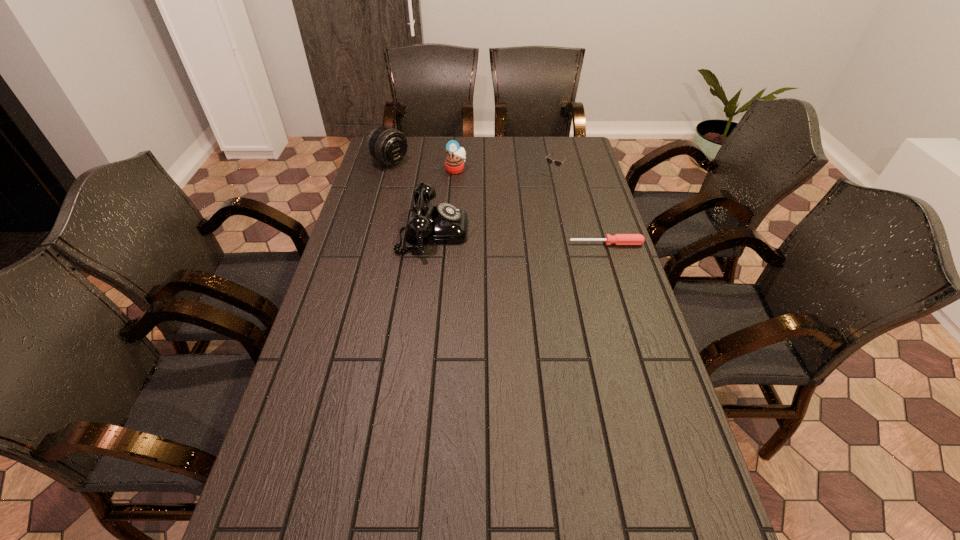
Locate an element on the screen. vacant area situated in front of the lenses of the fourth tallest object is located at coordinates (507, 219).

Identify the location of vacant area located 0.300m in front of the lenses of the fourth tallest object. This screenshot has width=960, height=540. (506, 220).

Where is `vacant space located in front of the lenses of the fourth tallest object`? Image resolution: width=960 pixels, height=540 pixels. vacant space located in front of the lenses of the fourth tallest object is located at coordinates (516, 208).

Where is `vacant area situated 0.090m on the front-facing side of the telephoto lens`? Image resolution: width=960 pixels, height=540 pixels. vacant area situated 0.090m on the front-facing side of the telephoto lens is located at coordinates (418, 177).

This screenshot has height=540, width=960. Find the location of `vacant position located 0.240m on the front-facing side of the telephoto lens`. vacant position located 0.240m on the front-facing side of the telephoto lens is located at coordinates (444, 192).

Locate an element on the screen. The height and width of the screenshot is (540, 960). vacant area situated 0.080m on the front-facing side of the telephoto lens is located at coordinates (416, 176).

Locate an element on the screen. The width and height of the screenshot is (960, 540). muffin that is at the far edge is located at coordinates (454, 162).

Locate an element on the screen. sunglasses positioned at the far edge is located at coordinates (549, 160).

Where is `telephoto lens present at the far edge`? Image resolution: width=960 pixels, height=540 pixels. telephoto lens present at the far edge is located at coordinates (387, 145).

Locate an element on the screen. object at the left edge is located at coordinates (387, 145).